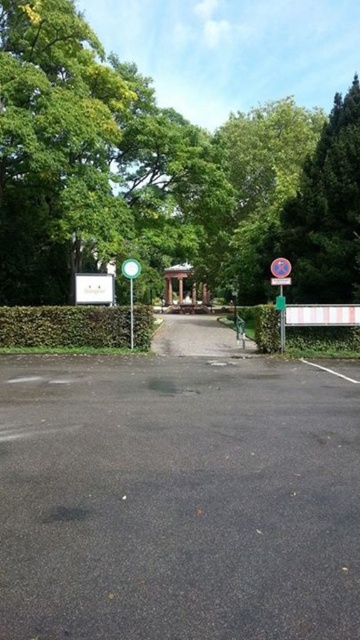
You are standing at the park entrance and want to find the green hedge at right. According to the coordinates provided, where should you look relative to your position?

The green hedge at right is located at point 0.528 on the horizontal axis and 0.897 on the vertical axis, so you should look to your right and slightly forward from your current position at the park entrance.

You are driving a car that is 4.5 meters long. You want to park your car between the black asphalt parking lot at center and the metallic round sign at center. Is there enough space for your car to fit between them?

The distance between the black asphalt parking lot at center and the metallic round sign at center is 8.22 meters. Since your car is 4.5 meters long, there is sufficient space to park between them as 8.22 meters is greater than 4.5 meters.

You are standing at the park entrance and want to walk towards the green leafy hedge at center and the metallic round sign at center. Which object will you encounter first?

The green leafy hedge at center will be encountered first since it is closer to the viewer compared to the metallic round sign at center.